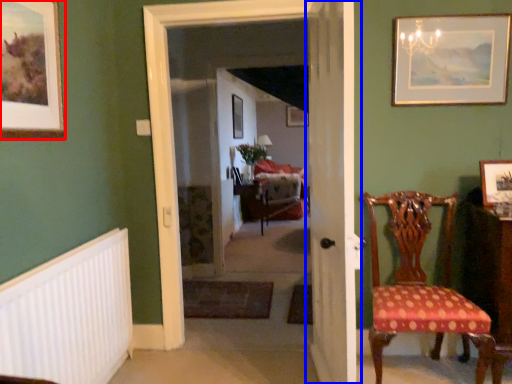
Question: Among these objects, which one is farthest to the camera, picture frame (highlighted by a red box) or door (highlighted by a blue box)?

Choices:
 (A) picture frame
 (B) door

Answer: (B)